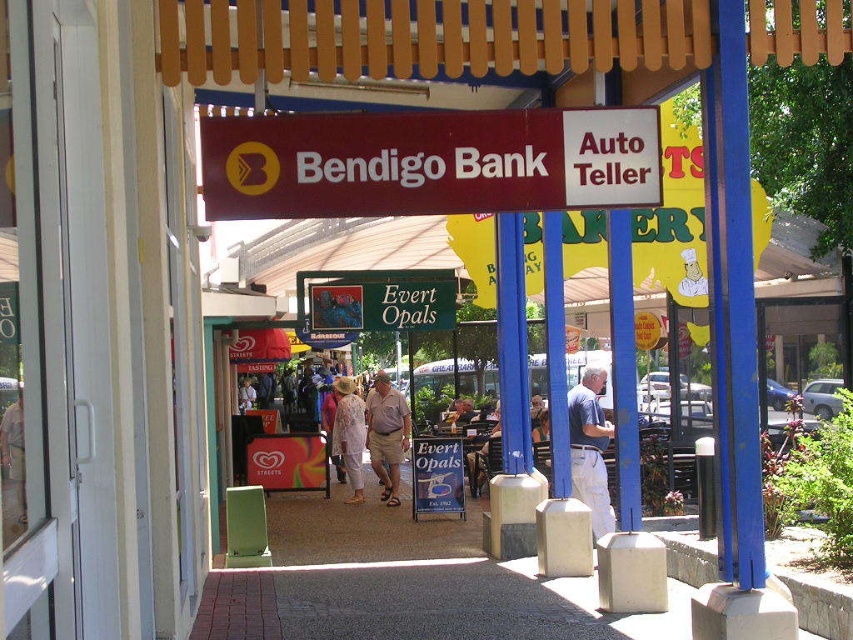
Question: Considering the relative positions of light blue shirt at center and khaki cotton shorts at center in the image provided, where is light blue shirt at center located with respect to khaki cotton shorts at center?

Choices:
 (A) right
 (B) left

Answer: (A)

Question: Which point is closer to the camera?

Choices:
 (A) (403, 417)
 (B) (579, 186)
 (C) (341, 400)
 (D) (585, 500)

Answer: (B)

Question: Which of the following is the farthest from the observer?

Choices:
 (A) pyautogui.click(x=296, y=193)
 (B) pyautogui.click(x=375, y=401)
 (C) pyautogui.click(x=582, y=484)
 (D) pyautogui.click(x=357, y=448)

Answer: (D)

Question: Is khaki cotton shorts at center positioned in front of light beige floral dress at center?

Choices:
 (A) yes
 (B) no

Answer: (A)

Question: Which object appears closest to the camera in this image?

Choices:
 (A) khaki cotton shorts at center
 (B) maroon plastic sign at center
 (C) light beige floral dress at center

Answer: (B)

Question: Is maroon plastic sign at center thinner than khaki cotton shorts at center?

Choices:
 (A) yes
 (B) no

Answer: (B)